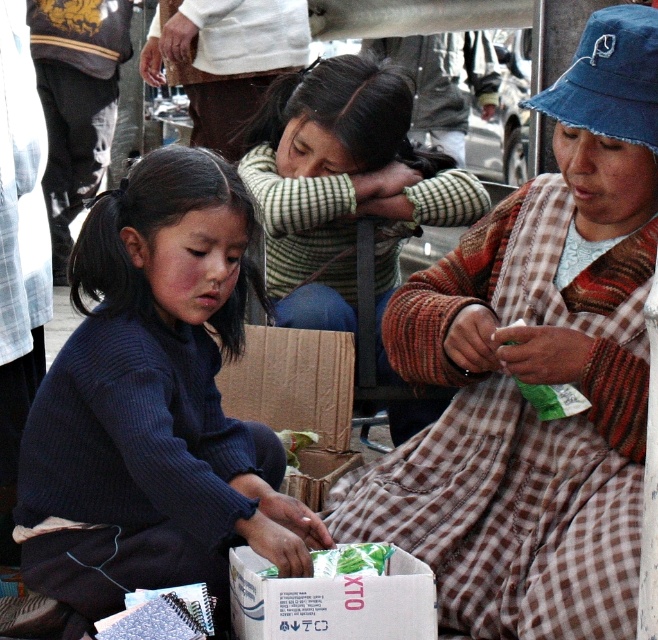
Question: Can you confirm if dark blue sweater at center is bigger than striped sweater at center?

Choices:
 (A) no
 (B) yes

Answer: (B)

Question: Is striped sweater at center to the right of white cardboard box at center from the viewer's perspective?

Choices:
 (A) no
 (B) yes

Answer: (B)

Question: Which object is positioned closest to the dark blue sweater at center?

Choices:
 (A) striped sweater at center
 (B) white cardboard box at center

Answer: (B)

Question: Which of the following is the farthest from the observer?

Choices:
 (A) brown checkered dress at center
 (B) white cardboard box at center
 (C) dark blue sweater at center

Answer: (A)

Question: Which object is the farthest from the dark blue sweater at center?

Choices:
 (A) brown checkered dress at center
 (B) striped sweater at center

Answer: (B)

Question: Observing the image, what is the correct spatial positioning of dark blue sweater at center in reference to white cardboard box at center?

Choices:
 (A) below
 (B) above

Answer: (B)